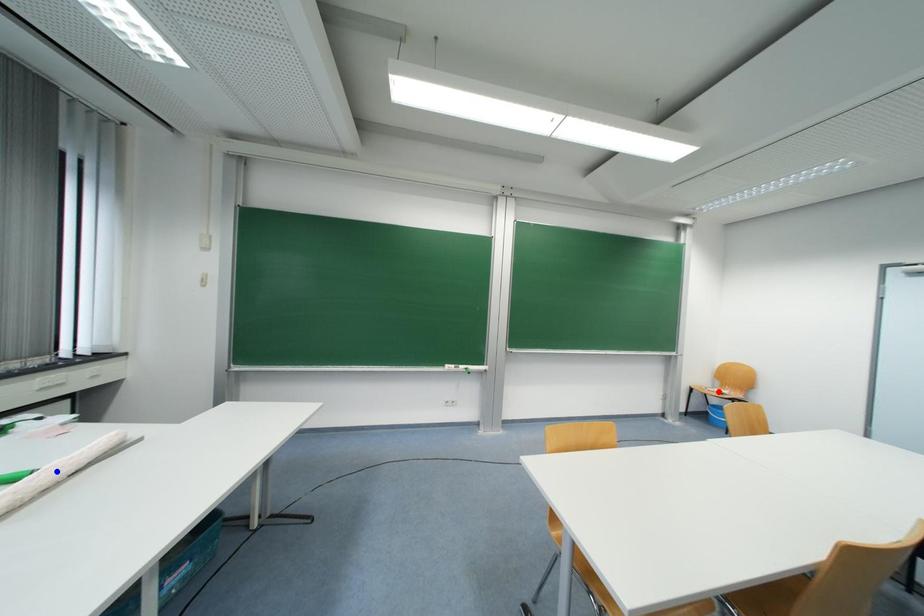
Question: In the image, two points are highlighted. Which point is nearer to the camera? Reply with the corresponding letter.

Choices:
 (A) blue point
 (B) red point

Answer: (A)